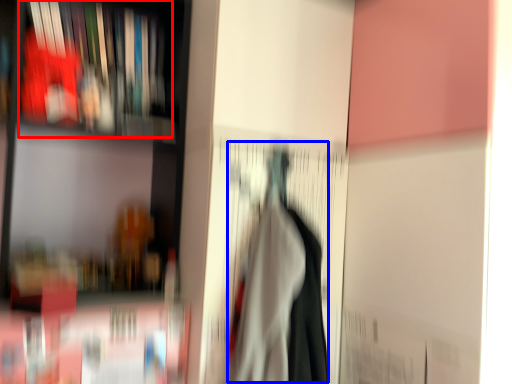
Question: Which object is further to the camera taking this photo, book (highlighted by a red box) or woman (highlighted by a blue box)?

Choices:
 (A) book
 (B) woman

Answer: (A)